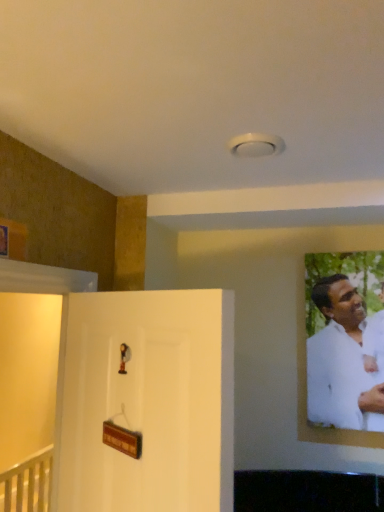
Describe the element at coordinates (149, 401) in the screenshot. The height and width of the screenshot is (512, 384). I see `white matte door at left` at that location.

Find the location of a particular element. The width and height of the screenshot is (384, 512). white matte door at left is located at coordinates (149, 401).

Based on the photo, in order to face white matte shirt at right, should I rotate leftwards or rightwards?

Turn right approximately 20.056 degrees to face it.

Identify the location of white matte shirt at right. This screenshot has height=512, width=384. (341, 362).

What do you see at coordinates (341, 362) in the screenshot? I see `white matte shirt at right` at bounding box center [341, 362].

What is the approximate height of white matte shirt at right?

white matte shirt at right is 29.65 inches in height.

Locate an element on the screen. Image resolution: width=384 pixels, height=512 pixels. white matte door at left is located at coordinates (149, 401).

Considering the positions of objects white matte door at left and white matte shirt at right in the image provided, who is more to the right, white matte door at left or white matte shirt at right?

From the viewer's perspective, white matte shirt at right appears more on the right side.

In the image, is white matte door at left positioned in front of or behind white matte shirt at right?

white matte door at left is in front of white matte shirt at right.

Considering the positions of point (185, 476) and point (318, 404), is point (185, 476) closer or farther from the camera than point (318, 404)?

Point (185, 476) is positioned closer to the camera compared to point (318, 404).

From the image's perspective, is white matte door at left beneath white matte shirt at right?

Yes.

From a real-world perspective, is white matte door at left beneath white matte shirt at right?

Yes, from a real-world perspective, white matte door at left is beneath white matte shirt at right.

Considering the sizes of objects white matte door at left and white matte shirt at right in the image provided, who is thinner, white matte door at left or white matte shirt at right?

white matte shirt at right is thinner.

Who is shorter, white matte door at left or white matte shirt at right?

white matte shirt at right.

Which of these two, white matte door at left or white matte shirt at right, is smaller?

With smaller size is white matte shirt at right.

Is white matte door at left situated inside white matte shirt at right or outside?

The correct answer is: outside.

Is white matte door at left touching white matte shirt at right?

No, white matte door at left is not making contact with white matte shirt at right.

Is white matte door at left facing towards white matte shirt at right?

No, white matte door at left does not turn towards white matte shirt at right.

Where is `man on the right of white matte door at left`? man on the right of white matte door at left is located at coordinates (341, 362).

Which object is positioned more to the left, white matte shirt at right or white matte door at left?

white matte door at left is more to the left.

Is white matte shirt at right in front of or behind white matte door at left in the image?

Visually, white matte shirt at right is located behind white matte door at left.

Does point (331, 394) appear closer or farther from the camera than point (59, 461)?

Point (331, 394).

From the image's perspective, is white matte shirt at right on white matte door at left?

Indeed, from the image's perspective, white matte shirt at right is shown above white matte door at left.

From a real-world perspective, is white matte shirt at right above or below white matte door at left?

white matte shirt at right is situated higher than white matte door at left in the real world.

Can you confirm if white matte shirt at right is thinner than white matte door at left?

Yes.

Which of these two, white matte shirt at right or white matte door at left, stands shorter?

white matte shirt at right.

Which of these two, white matte shirt at right or white matte door at left, is smaller?

white matte shirt at right is smaller.

Is white matte shirt at right outside of white matte door at left?

white matte shirt at right lies outside white matte door at left's area.

Is white matte shirt at right not near white matte door at left?

white matte shirt at right is far away from white matte door at left.

Does white matte shirt at right turn towards white matte door at left?

No, white matte shirt at right is not facing towards white matte door at left.

In the image, there is a white matte shirt at right. At what (x,y) coordinates should I click in order to perform the action: click on door below it (from a real-world perspective). Please return your answer as a coordinate pair (x, y). The width and height of the screenshot is (384, 512). Looking at the image, I should click on (149, 401).

This screenshot has height=512, width=384. I want to click on door on the left of white matte shirt at right, so point(149,401).

Locate an element on the screen. This screenshot has height=512, width=384. man on the right of white matte door at left is located at coordinates (341, 362).